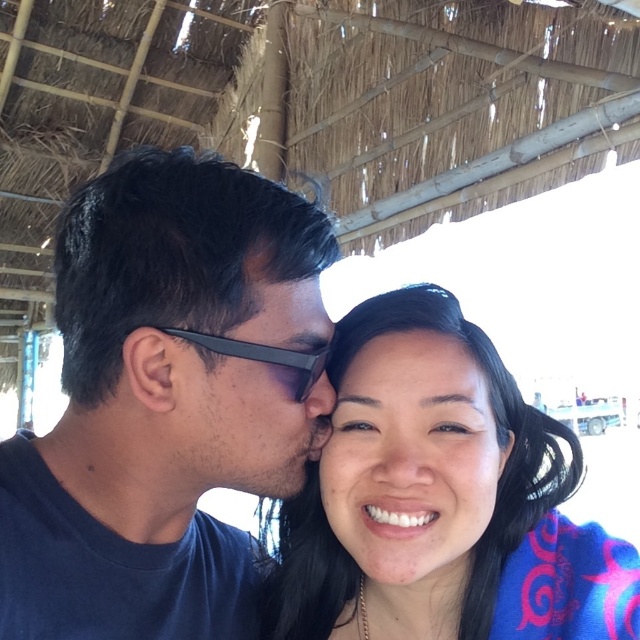
You are a photographer standing in front of the dark blue shirt at left. You want to take a photo of the shirt without any blur. The camera requires a minimum distance of 25 inches to focus properly. Can you take the photo clearly?

The dark blue shirt at left and viewer are 24.64 inches apart from each other. Since the camera requires a minimum distance of 25 inches to focus properly, the photographer is too close to take a clear photo without blur.

From the picture: You are a photographer trying to capture a portrait of the dark blue shirt at left and the smooth skin at center. Based on their positions in the image, which object should you focus on first to ensure it appears sharp in the photo?

The dark blue shirt at left is taller than smooth skin at center, so you should focus on the dark blue shirt at left first to ensure it appears sharp in the photo.